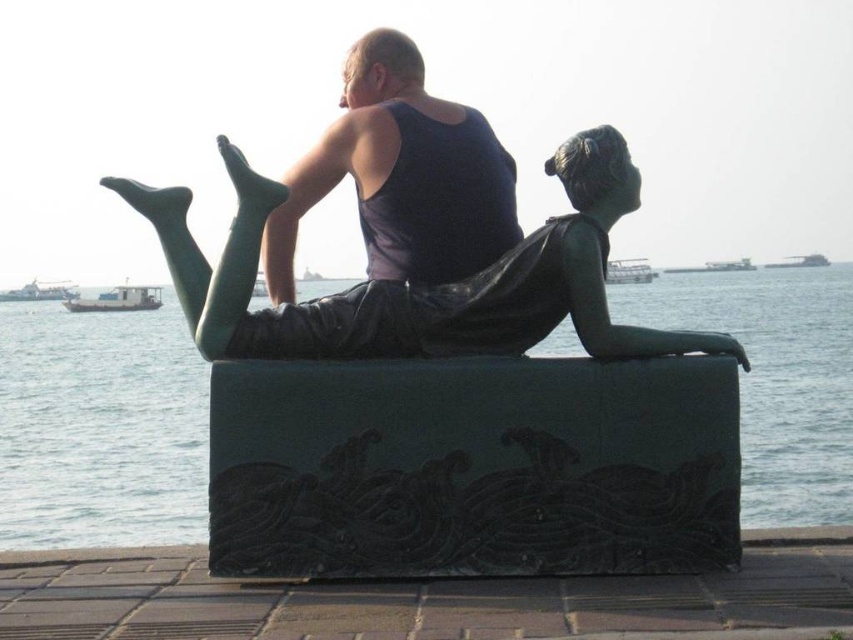
You are an art student analyzing the sculpture. You notice the matte black tank top at center and the metallic gray ship at upper center. Which object appears nearer to you in the artwork?

The matte black tank top at center is closer to the viewer than the metallic gray ship at upper center, so the matte black tank top at center appears nearer in the artwork.

You are a tour guide explaining the sculpture to visitors. You mention that the bronze statue of woman at center and the metallic gray boat at upper center are part of the artwork. A visitor asks if they are close to each other in the sculpture. How do you respond?

The bronze statue of woman at center and the metallic gray boat at upper center are 427.49 feet apart from each other, so they are not close to each other in the sculpture.

You are an art student analyzing the sculpture. You notice the bronze statue of woman at center and the metallic gray boat at upper center. Which object is taller?

The bronze statue of woman at center is taller than the metallic gray boat at upper center according to the description.